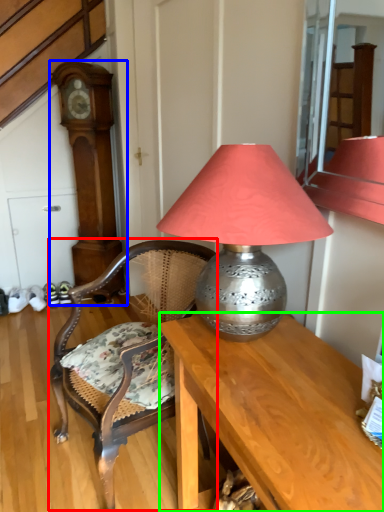
Question: Considering the real-world distances, which object is farthest from chair (highlighted by a red box)? clock (highlighted by a blue box) or desk (highlighted by a green box)?

Choices:
 (A) clock
 (B) desk

Answer: (A)